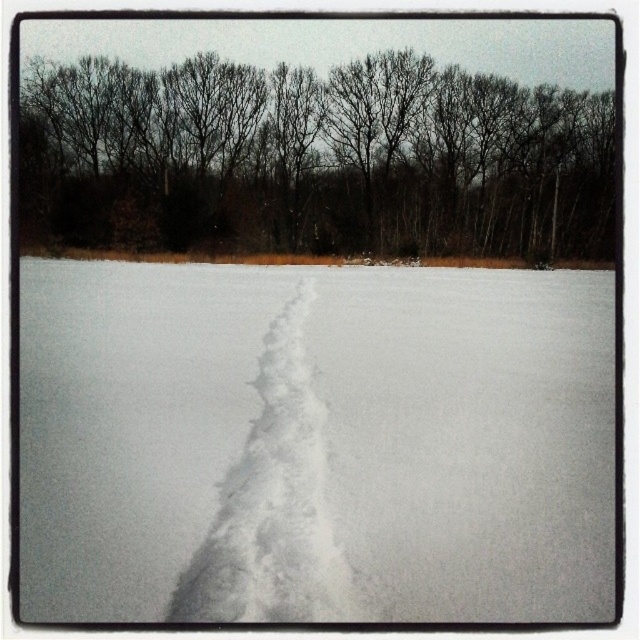
Does bare branches at upper center have a lesser height compared to white fluffy snow trail at center?

Incorrect, bare branches at upper center's height does not fall short of white fluffy snow trail at center's.

Measure the distance between bare branches at upper center and camera.

bare branches at upper center is 56.80 meters from camera.

Who is more forward, (301, 160) or (332, 552)?

Point (332, 552)

At what (x,y) coordinates should I click in order to perform the action: click on bare branches at upper center. Please return your answer as a coordinate pair (x, y). The width and height of the screenshot is (640, 640). Looking at the image, I should click on (314, 160).